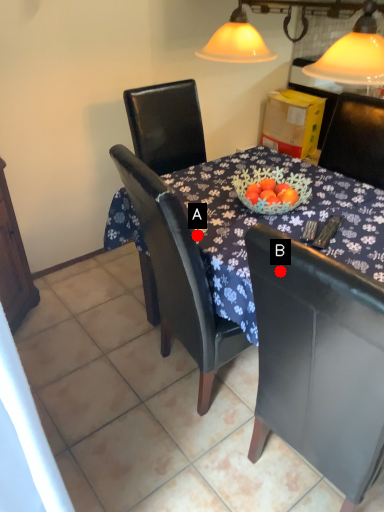
Question: Two points are circled on the image, labeled by A and B beside each circle. Among these points, which one is nearest to the camera?

Choices:
 (A) A is closer
 (B) B is closer

Answer: (B)